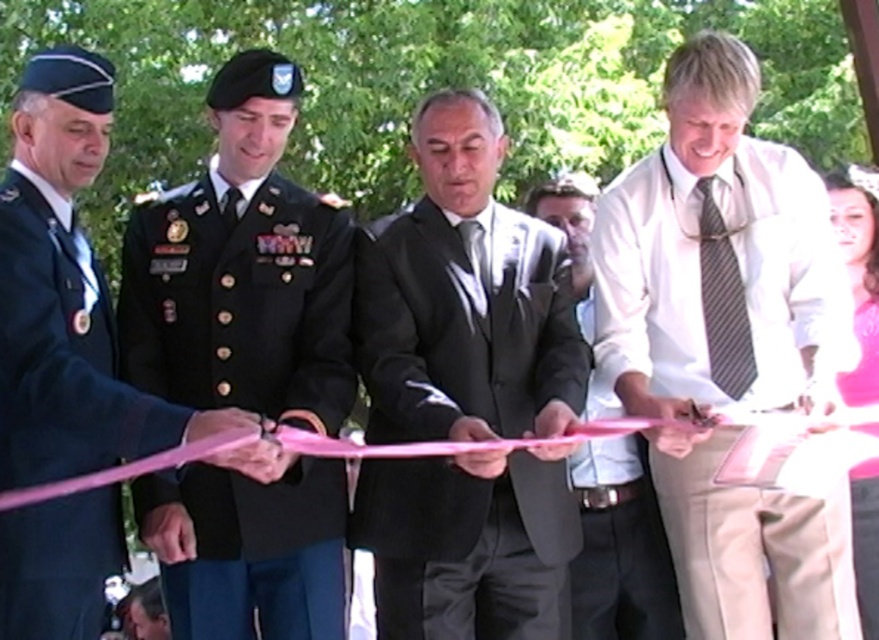
Question: In this image, where is dark green military uniform at center located relative to pink satin dress at lower right?

Choices:
 (A) below
 (B) above

Answer: (B)

Question: Considering the real-world distances, which object is closest to the pink satin dress at lower right?

Choices:
 (A) dark blue fabric uniform at left
 (B) white striped tie at center
 (C) dark green military uniform at center
 (D) white shirt at center

Answer: (D)

Question: Which object is the farthest from the white striped tie at center?

Choices:
 (A) dark blue fabric uniform at left
 (B) matte black suit at center
 (C) pink satin dress at lower right

Answer: (A)

Question: Does dark blue fabric uniform at left have a smaller size compared to white shirt at center?

Choices:
 (A) no
 (B) yes

Answer: (A)

Question: Which point is farther to the camera?

Choices:
 (A) (703, 60)
 (B) (49, 272)

Answer: (A)

Question: Considering the relative positions of dark blue fabric uniform at left and white shirt at center in the image provided, where is dark blue fabric uniform at left located with respect to white shirt at center?

Choices:
 (A) below
 (B) above

Answer: (B)